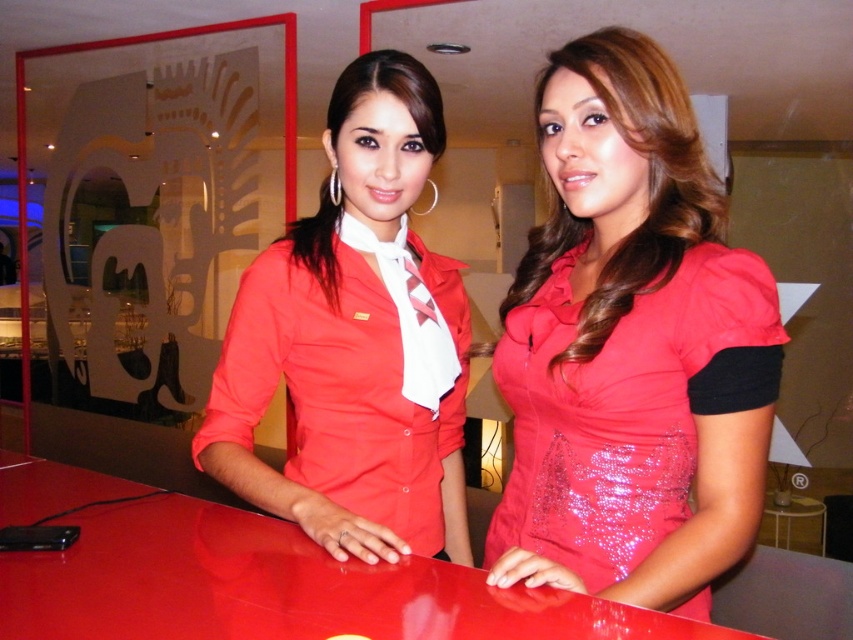
You are a customer in a store and want to see the shiny red dress at center. The glossy red table at center is blocking your view. Can you walk around the table to see the dress?

The glossy red table at center is behind the shiny red dress at center, so the table is not blocking your view. You can see the dress directly without needing to walk around the table.

You are a customer in a store and you see the shiny red dress at center and the glossy red table at center. Which object is located to the right of the other?

The shiny red dress at center is positioned on the right side of the glossy red table at center.